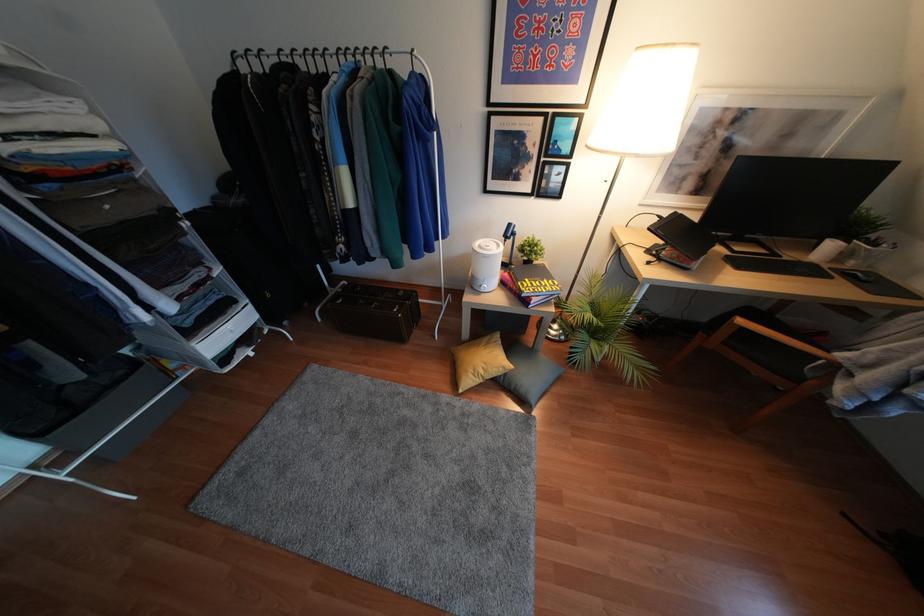
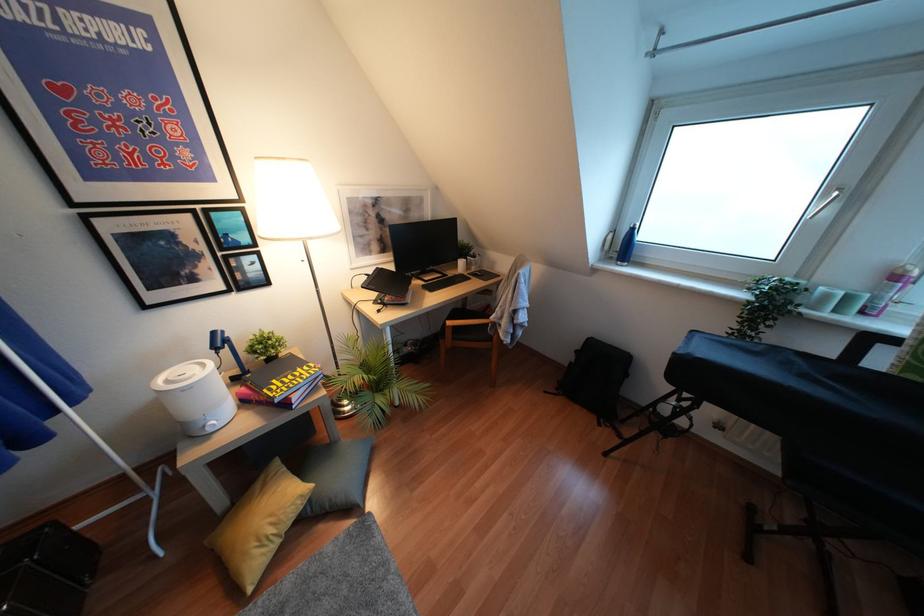
Locate, in the second image, the point that corresponds to [523,294] in the first image.

(275, 400)